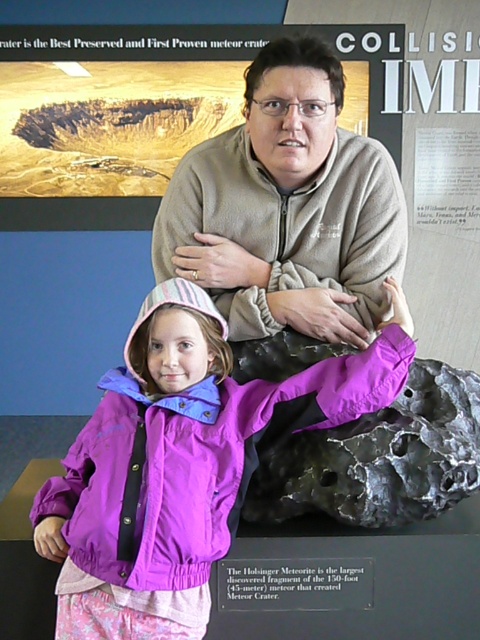
You are a photographer trying to capture both the purple nylon jacket at center and the rough metallic rock at center in the same frame. Based on their heights, which object should you focus on first to ensure both are fully visible?

The purple nylon jacket at center is taller than the rough metallic rock at center, so you should focus on the purple nylon jacket at center first to ensure both are fully visible.

You are standing in front of the meteor crater exhibit and notice two points marked on the floor. The first point is labeled as point (230, 381) and the second is point (311, 330). If you want to touch the point that is closer to you, which one should you reach for?

Point (230, 381) is closer to the viewer than point (311, 330), so you should reach for point (230, 381).

You are a photographer trying to capture a clear photo of the purple nylon jacket at center and the rough metallic rock at center. If you want to ensure both are in focus, what should you consider about their distance?

The purple nylon jacket at center and the rough metallic rock at center are only 8.31 inches apart. Since they are very close to each other, adjusting the camera focus to a small depth of field should keep both in focus easily.